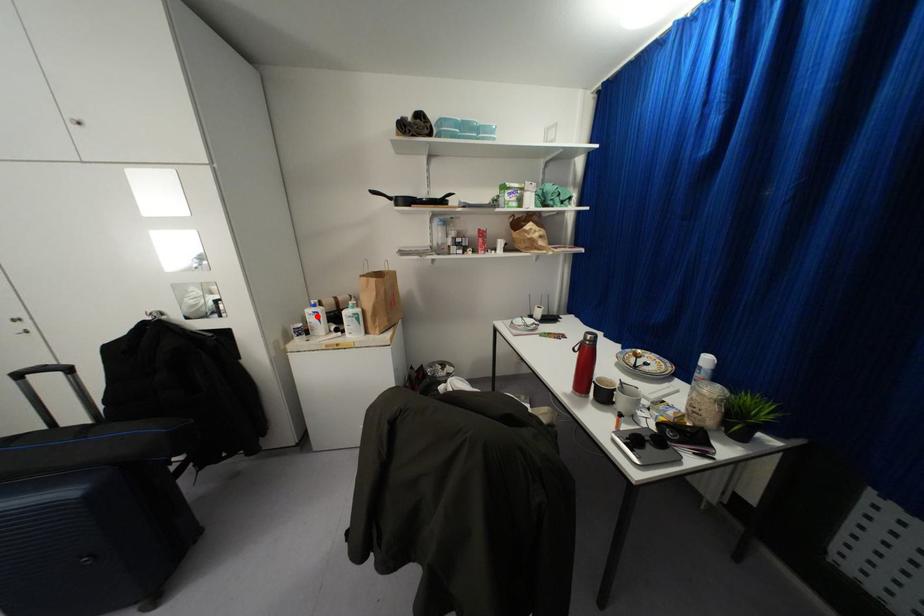
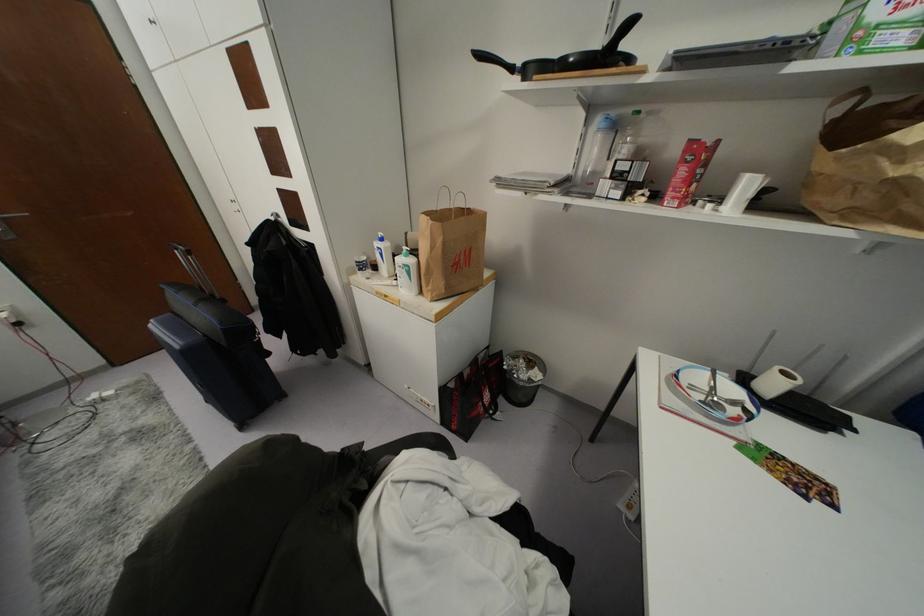
Locate, in the second image, the point that corresponds to the highlighted location in the first image.

(381, 254)